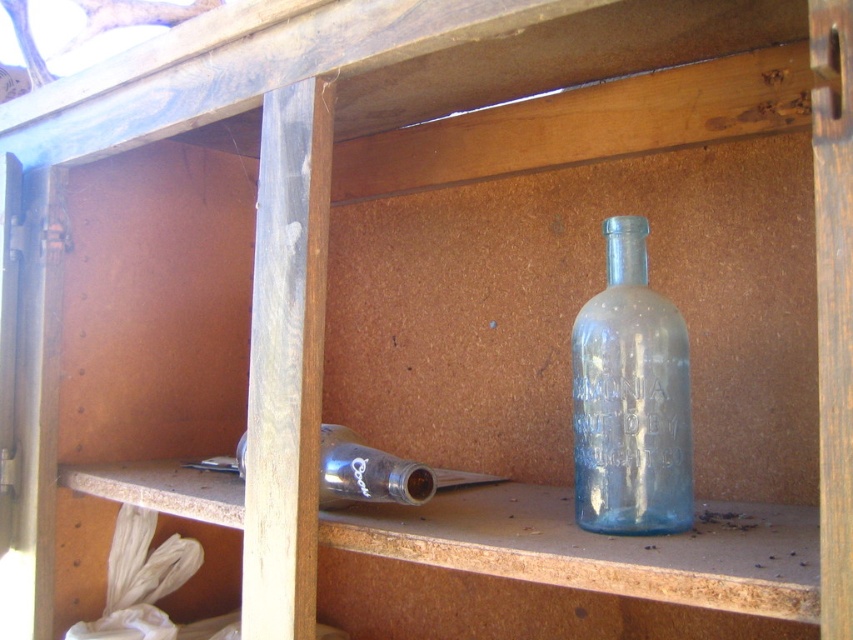
Between blue glass bottle at center and transparent glass bottle at lower left, which one has more height?

With more height is blue glass bottle at center.

Does blue glass bottle at center appear on the right side of transparent glass bottle at lower left?

Indeed, blue glass bottle at center is positioned on the right side of transparent glass bottle at lower left.

Is point (659, 385) more distant than point (328, 449)?

That is False.

Find the location of a particular element. This screenshot has width=853, height=640. blue glass bottle at center is located at coordinates (630, 397).